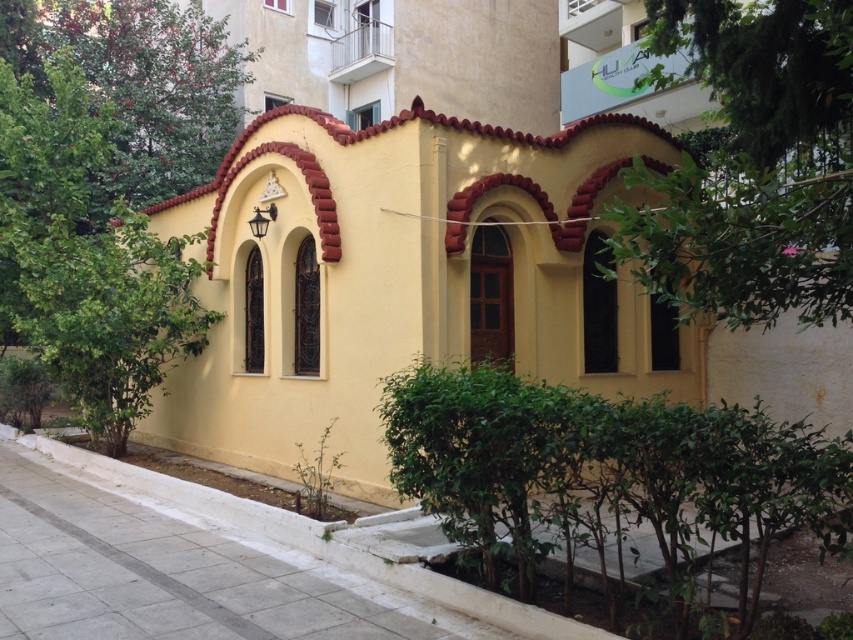
In the scene shown: You are a gardener planning to plant a new tree in the area near the white concrete pavement at lower center. Considering the existing green leafy tree at center, which one is bigger in size?

The green leafy tree at center is larger in size compared to the white concrete pavement at lower center.

You are a visitor approaching the yellow matte building at center and notice the green leafy tree at upper right. Which object is closer to you from your current viewpoint?

The yellow matte building at center is closer to you than the green leafy tree at upper right, which is positioned behind it.